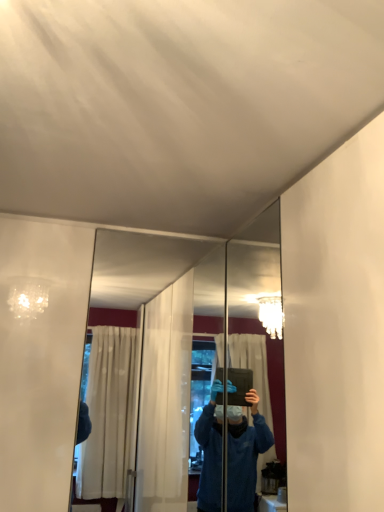
Describe the element at coordinates (123, 346) in the screenshot. I see `clear glass mirror at center, the 2th mirror when ordered from right to left` at that location.

You are a GUI agent. You are given a task and a screenshot of the screen. Output one action in this format:
    pyautogui.click(x=<x>, y=<y>)
    Task: Click on the clear glass mirror at center, the 1th mirror when ordered from left to right
    This screenshot has height=512, width=384.
    Given the screenshot: What is the action you would take?
    pyautogui.click(x=123, y=346)

What do you see at coordinates (258, 314) in the screenshot? Image resolution: width=384 pixels, height=512 pixels. I see `polished silver mirror at center, the second mirror viewed from the left` at bounding box center [258, 314].

Identify the location of polished silver mirror at center, the second mirror viewed from the left. (258, 314).

Locate an element on the screen. clear glass mirror at center, the 2th mirror when ordered from right to left is located at coordinates (123, 346).

Which object is positioned more to the right, clear glass mirror at center, the 2th mirror when ordered from right to left, or polished silver mirror at center, acting as the first mirror starting from the right?

polished silver mirror at center, acting as the first mirror starting from the right, is more to the right.

Considering their positions, is clear glass mirror at center, the 2th mirror when ordered from right to left, located in front of or behind polished silver mirror at center, acting as the first mirror starting from the right?

clear glass mirror at center, the 2th mirror when ordered from right to left, is behind polished silver mirror at center, acting as the first mirror starting from the right.

Which is nearer, (127,273) or (249,247)?

Clearly, point (127,273) is closer to the camera than point (249,247).

From the image's perspective, which is below, clear glass mirror at center, the 2th mirror when ordered from right to left, or polished silver mirror at center, the second mirror viewed from the left?

From the image's view, clear glass mirror at center, the 2th mirror when ordered from right to left, is below.

Based on the photo, from a real-world perspective, is clear glass mirror at center, the 2th mirror when ordered from right to left, physically located above or below polished silver mirror at center, the second mirror viewed from the left?

clear glass mirror at center, the 2th mirror when ordered from right to left, is above polished silver mirror at center, the second mirror viewed from the left.

Does clear glass mirror at center, the 1th mirror when ordered from left to right, have a greater width compared to polished silver mirror at center, the second mirror viewed from the left?

In fact, clear glass mirror at center, the 1th mirror when ordered from left to right, might be narrower than polished silver mirror at center, the second mirror viewed from the left.

Does clear glass mirror at center, the 2th mirror when ordered from right to left, have a greater height compared to polished silver mirror at center, the second mirror viewed from the left?

Yes.

Who is bigger, clear glass mirror at center, the 1th mirror when ordered from left to right, or polished silver mirror at center, the second mirror viewed from the left?

Bigger between the two is polished silver mirror at center, the second mirror viewed from the left.

Would you say clear glass mirror at center, the 1th mirror when ordered from left to right, contains polished silver mirror at center, the second mirror viewed from the left?

No, clear glass mirror at center, the 1th mirror when ordered from left to right, does not contain polished silver mirror at center, the second mirror viewed from the left.

Are clear glass mirror at center, the 1th mirror when ordered from left to right, and polished silver mirror at center, acting as the first mirror starting from the right, making contact?

No, clear glass mirror at center, the 1th mirror when ordered from left to right, is not touching polished silver mirror at center, acting as the first mirror starting from the right.

Is clear glass mirror at center, the 1th mirror when ordered from left to right, turned away from polished silver mirror at center, the second mirror viewed from the left?

clear glass mirror at center, the 1th mirror when ordered from left to right, does not have its back to polished silver mirror at center, the second mirror viewed from the left.

Consider the image. Measure the distance from clear glass mirror at center, the 1th mirror when ordered from left to right, to polished silver mirror at center, acting as the first mirror starting from the right.

The distance of clear glass mirror at center, the 1th mirror when ordered from left to right, from polished silver mirror at center, acting as the first mirror starting from the right, is 1.15 meters.

You are a GUI agent. You are given a task and a screenshot of the screen. Output one action in this format:
    pyautogui.click(x=<x>, y=<y>)
    Task: Click on the mirror above the clear glass mirror at center, the 1th mirror when ordered from left to right (from the image's perspective)
    Image resolution: width=384 pixels, height=512 pixels.
    Given the screenshot: What is the action you would take?
    pyautogui.click(x=258, y=314)

Between polished silver mirror at center, the second mirror viewed from the left, and clear glass mirror at center, the 2th mirror when ordered from right to left, which one appears on the right side from the viewer's perspective?

polished silver mirror at center, the second mirror viewed from the left.

Which object is closer to the camera, polished silver mirror at center, acting as the first mirror starting from the right, or clear glass mirror at center, the 2th mirror when ordered from right to left?

polished silver mirror at center, acting as the first mirror starting from the right.

Is point (276, 333) positioned behind point (89, 321)?

Yes, point (276, 333) is farther from viewer.

From the image's perspective, is polished silver mirror at center, the second mirror viewed from the left, above clear glass mirror at center, the 2th mirror when ordered from right to left?

Yes, from the image's perspective, polished silver mirror at center, the second mirror viewed from the left, is over clear glass mirror at center, the 2th mirror when ordered from right to left.

From a real-world perspective, is polished silver mirror at center, the second mirror viewed from the left, on clear glass mirror at center, the 1th mirror when ordered from left to right?

No, from a real-world perspective, polished silver mirror at center, the second mirror viewed from the left, is not over clear glass mirror at center, the 1th mirror when ordered from left to right

Can you confirm if polished silver mirror at center, the second mirror viewed from the left, is wider than clear glass mirror at center, the 2th mirror when ordered from right to left?

Yes, polished silver mirror at center, the second mirror viewed from the left, is wider than clear glass mirror at center, the 2th mirror when ordered from right to left.

Who is taller, polished silver mirror at center, acting as the first mirror starting from the right, or clear glass mirror at center, the 2th mirror when ordered from right to left?

With more height is clear glass mirror at center, the 2th mirror when ordered from right to left.

Can you confirm if polished silver mirror at center, the second mirror viewed from the left, is smaller than clear glass mirror at center, the 1th mirror when ordered from left to right?

No.

Does polished silver mirror at center, acting as the first mirror starting from the right, contain clear glass mirror at center, the 1th mirror when ordered from left to right?

That's incorrect, clear glass mirror at center, the 1th mirror when ordered from left to right, is not inside polished silver mirror at center, acting as the first mirror starting from the right.

Does polished silver mirror at center, the second mirror viewed from the left, touch clear glass mirror at center, the 1th mirror when ordered from left to right?

No, polished silver mirror at center, the second mirror viewed from the left, is not making contact with clear glass mirror at center, the 1th mirror when ordered from left to right.

Is polished silver mirror at center, the second mirror viewed from the left, turned away from clear glass mirror at center, the 1th mirror when ordered from left to right?

No, polished silver mirror at center, the second mirror viewed from the left, is not facing the opposite direction of clear glass mirror at center, the 1th mirror when ordered from left to right.

How many degrees apart are the facing directions of polished silver mirror at center, the second mirror viewed from the left, and clear glass mirror at center, the 2th mirror when ordered from right to left?

90.9 degrees.

Could you measure the distance between polished silver mirror at center, the second mirror viewed from the left, and clear glass mirror at center, the 2th mirror when ordered from right to left?

polished silver mirror at center, the second mirror viewed from the left, and clear glass mirror at center, the 2th mirror when ordered from right to left, are 1.15 meters apart.

At what (x,y) coordinates should I click in order to perform the action: click on mirror lying on the left of polished silver mirror at center, acting as the first mirror starting from the right. Please return your answer as a coordinate pair (x, y). This screenshot has height=512, width=384. Looking at the image, I should click on (123, 346).

Find the location of a particular element. This screenshot has width=384, height=512. mirror located underneath the clear glass mirror at center, the 2th mirror when ordered from right to left (from a real-world perspective) is located at coordinates (258, 314).

Locate an element on the screen. The image size is (384, 512). mirror on the right side of clear glass mirror at center, the 2th mirror when ordered from right to left is located at coordinates (258, 314).